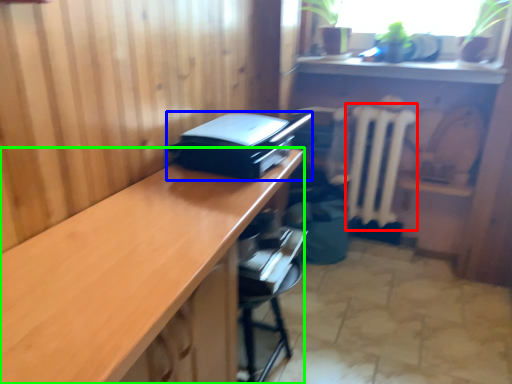
Question: Based on their relative distances, which object is farther from radiator (highlighted by a red box)? Choose from printer (highlighted by a blue box) and desk (highlighted by a green box).

Choices:
 (A) printer
 (B) desk

Answer: (B)